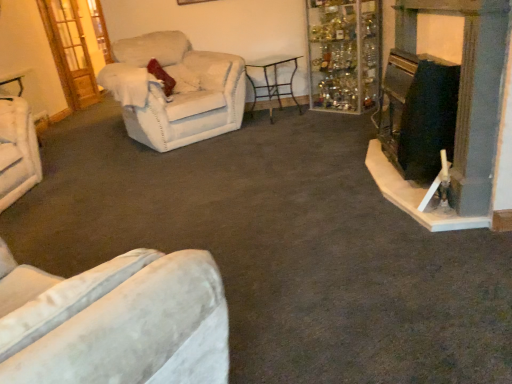
Question: Is beige fabric armchair at left, the 2th chair when ordered from left to right, positioned far away from black matte fireplace at right?

Choices:
 (A) yes
 (B) no

Answer: (A)

Question: From a real-world perspective, is beige fabric armchair at left, the 2th chair when ordered from left to right, physically below black matte fireplace at right?

Choices:
 (A) yes
 (B) no

Answer: (A)

Question: Does beige fabric armchair at left, the 2th chair when ordered from left to right, have a smaller size compared to black matte fireplace at right?

Choices:
 (A) no
 (B) yes

Answer: (A)

Question: Could black matte fireplace at right be considered to be inside beige fabric armchair at left, the first chair viewed from the right?

Choices:
 (A) yes
 (B) no

Answer: (B)

Question: Is beige fabric armchair at left, the 2th chair when ordered from left to right, shorter than black matte fireplace at right?

Choices:
 (A) no
 (B) yes

Answer: (B)

Question: Does beige fabric armchair at left, the first chair viewed from the right, come behind black matte fireplace at right?

Choices:
 (A) no
 (B) yes

Answer: (B)

Question: Can you confirm if beige fabric armchair at left, the first chair viewed from the right, is shorter than metallic black table at center?

Choices:
 (A) no
 (B) yes

Answer: (A)

Question: Does beige fabric armchair at left, the first chair viewed from the right, come behind metallic black table at center?

Choices:
 (A) no
 (B) yes

Answer: (A)

Question: Is beige fabric armchair at left, the 2th chair when ordered from left to right, turned away from metallic black table at center?

Choices:
 (A) yes
 (B) no

Answer: (B)

Question: Is beige fabric armchair at left, the first chair viewed from the right, to the right of metallic black table at center from the viewer's perspective?

Choices:
 (A) yes
 (B) no

Answer: (B)

Question: Can you confirm if beige fabric armchair at left, the first chair viewed from the right, is smaller than metallic black table at center?

Choices:
 (A) no
 (B) yes

Answer: (A)

Question: From a real-world perspective, is beige fabric armchair at left, the first chair viewed from the right, on metallic black table at center?

Choices:
 (A) no
 (B) yes

Answer: (B)

Question: Considering the relative positions of metallic black table at center and wooden door at upper left in the image provided, is metallic black table at center to the right of wooden door at upper left from the viewer's perspective?

Choices:
 (A) yes
 (B) no

Answer: (A)